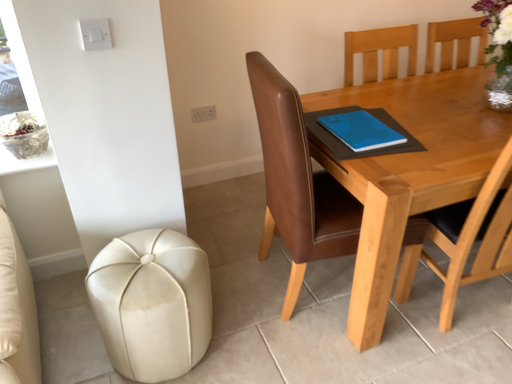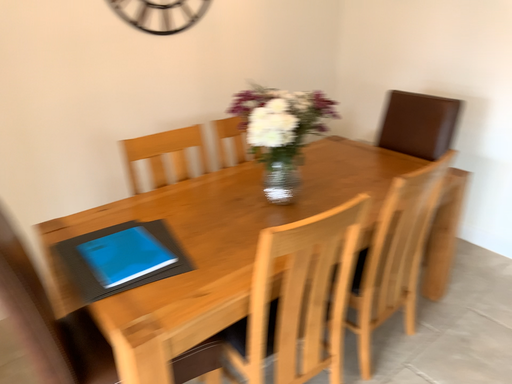
Question: How did the camera likely rotate when shooting the video?

Choices:
 (A) rotated downward
 (B) rotated upward

Answer: (B)